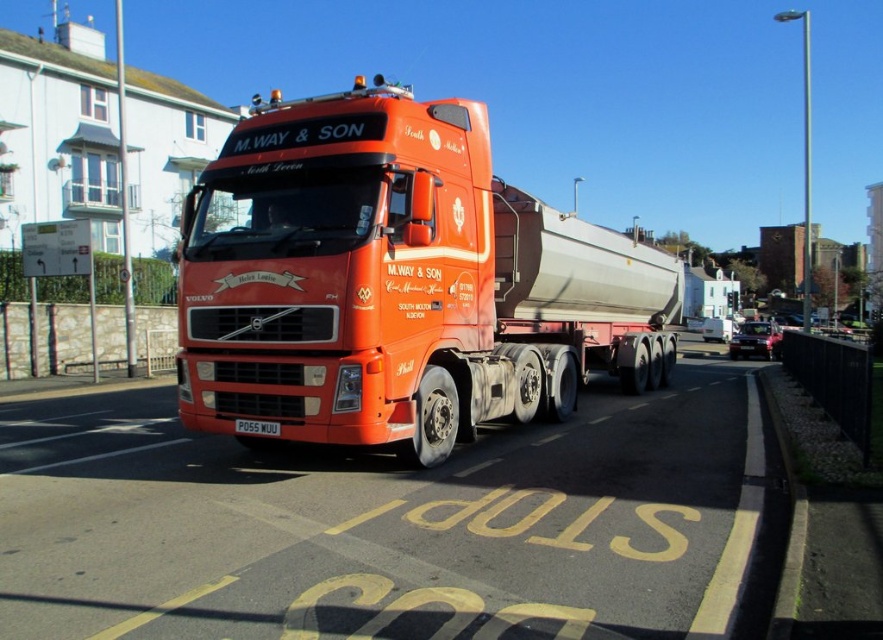
Is matte orange truck at center bigger than white plastic license plate at center?

Correct, matte orange truck at center is larger in size than white plastic license plate at center.

Is matte orange truck at center shorter than white plastic license plate at center?

In fact, matte orange truck at center may be taller than white plastic license plate at center.

Is point (225, 428) more distant than point (265, 426)?

Yes.

I want to click on matte orange truck at center, so click(398, 282).